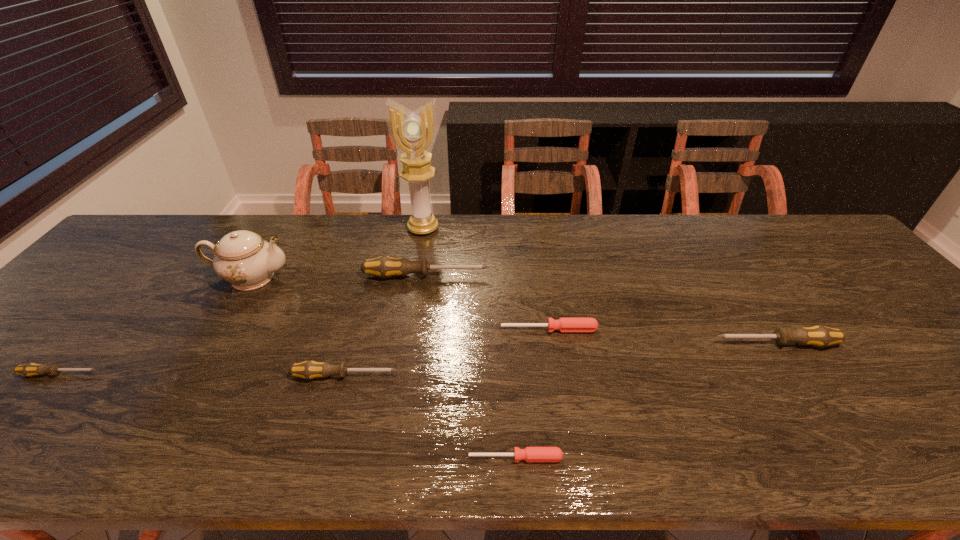
You are a GUI agent. You are given a task and a screenshot of the screen. Output one action in this format:
    pyautogui.click(x=<x>, y=<y>)
    Task: Click on the vacant area that lies between the smaller red screwdriver and the second object from left to right
    
    Given the screenshot: What is the action you would take?
    pyautogui.click(x=383, y=368)

I want to click on free spot between the farthest gray screwdriver and the second tallest object, so click(x=339, y=276).

Find the location of a particular element. The image size is (960, 540). the seventh closest object relative to the second smallest gray screwdriver is located at coordinates (820, 336).

Identify which object is located as the fourth nearest to the third tallest object. Please provide its 2D coordinates. Your answer should be formatted as a tuple, i.e. [(x, y)], where the tuple contains the x and y coordinates of a point satisfying the conditions above.

[(310, 369)]

Point out which screwdriver is positioned as the fourth nearest to the fourth shortest screwdriver. Please provide its 2D coordinates. Your answer should be formatted as a tuple, i.e. [(x, y)], where the tuple contains the x and y coordinates of a point satisfying the conditions above.

[(31, 369)]

At what (x,y) coordinates should I click in order to perform the action: click on screwdriver object that ranks as the fourth closest to the shortest object. Please return your answer as a coordinate pair (x, y). The width and height of the screenshot is (960, 540). Looking at the image, I should click on (384, 267).

This screenshot has height=540, width=960. What are the coordinates of `gray screwdriver that is the second closest to the bigger red screwdriver` in the screenshot? It's located at (310, 369).

Select which gray screwdriver is the closest to the smaller red screwdriver. Please provide its 2D coordinates. Your answer should be formatted as a tuple, i.e. [(x, y)], where the tuple contains the x and y coordinates of a point satisfying the conditions above.

[(310, 369)]

At what (x,y) coordinates should I click in order to perform the action: click on free location that satisfies the following two spatial constraints: 1. on the back side of the nearer red screwdriver; 2. at the tip of the leftmost screwdriver. Please return your answer as a coordinate pair (x, y). Looking at the image, I should click on (510, 374).

This screenshot has height=540, width=960. I want to click on vacant space that satisfies the following two spatial constraints: 1. at the tip of the smaller red screwdriver; 2. on the right side of the second smallest gray screwdriver, so click(323, 458).